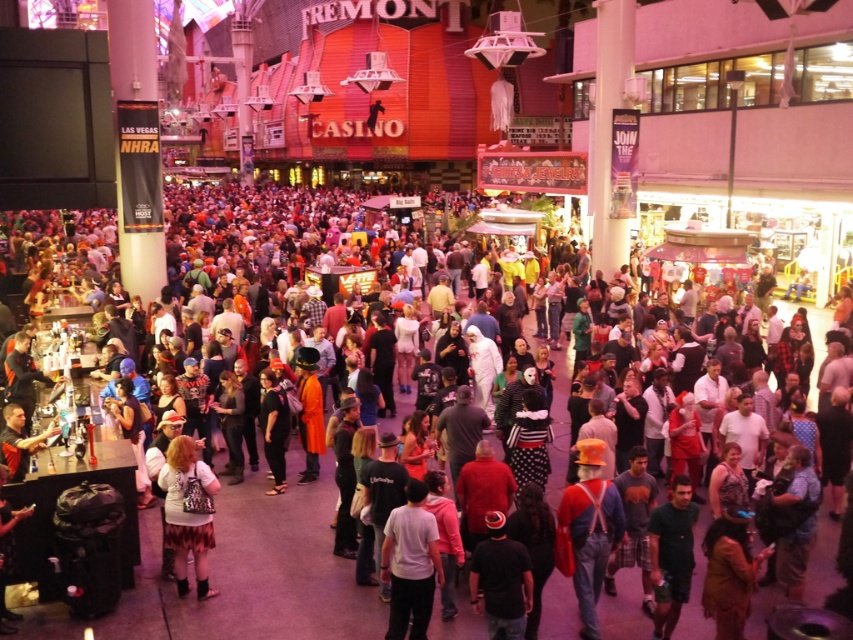
Looking at this image, you are standing in the Fremont Casino and want to take a photo of both the point at coordinates (587,563) and the point at (270,452). Which point should you focus on first to ensure both are in focus?

You should focus on the point at coordinates (587,563) first because it is closer to the camera, ensuring both points will be in focus when using a proper focal length.

You are a photographer at the Fremont Casino event and want to capture a photo of both the multicolored costumes at center and the dark green shirt at center. Which object should you focus on first to ensure both are in frame without moving the camera?

You should focus on the multicolored costumes at center first because it is much taller than the dark green shirt at center, ensuring both will be in frame by centering on the taller object.